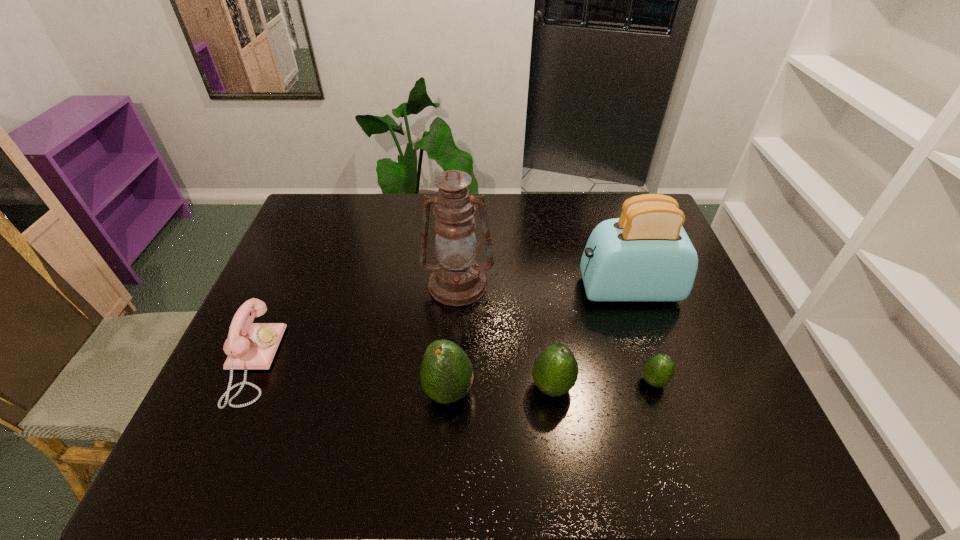
Where is `free spot located 0.050m on the right of the shortest avocado`? free spot located 0.050m on the right of the shortest avocado is located at coordinates pyautogui.click(x=688, y=381).

Locate an element on the screen. Image resolution: width=960 pixels, height=540 pixels. vacant space situated on the side of the toaster with the lever is located at coordinates (561, 289).

In order to click on free space located 0.350m on the side of the toaster with the lever in this screenshot , I will do `click(458, 289)`.

Where is `vacant space situated on the side of the toaster with the lever`? The image size is (960, 540). vacant space situated on the side of the toaster with the lever is located at coordinates (465, 289).

The image size is (960, 540). In order to click on vacant region located on the left of the tallest object in this screenshot , I will do `click(362, 285)`.

This screenshot has height=540, width=960. Find the location of `blank space located 0.180m on the dial of the telephone`. blank space located 0.180m on the dial of the telephone is located at coordinates (x=347, y=363).

Where is `telephone at the near edge`? This screenshot has width=960, height=540. telephone at the near edge is located at coordinates (249, 345).

Image resolution: width=960 pixels, height=540 pixels. Find the location of `object situated at the left edge`. object situated at the left edge is located at coordinates (249, 345).

Where is `object present at the right edge`? object present at the right edge is located at coordinates (645, 255).

Find the location of a particular element. object positioned at the near left corner is located at coordinates (249, 345).